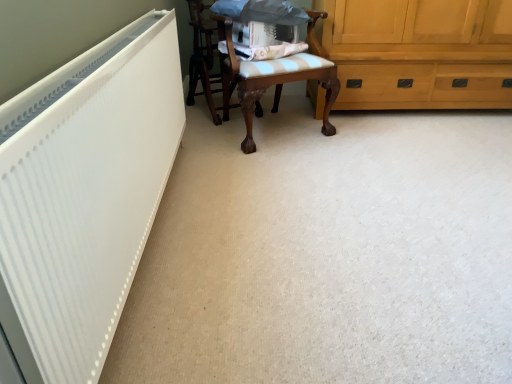
Question: Should I look upward or downward to see wooden chair with cushion at center, which is the second chair from right to left?

Choices:
 (A) down
 (B) up

Answer: (B)

Question: Is wooden chair with striped cushion at center, the 1th chair positioned from the right, in front of white matte radiator at left?

Choices:
 (A) yes
 (B) no

Answer: (B)

Question: Is wooden chair with striped cushion at center, which is the 2th chair in left-to-right order, oriented towards white matte radiator at left?

Choices:
 (A) yes
 (B) no

Answer: (B)

Question: Does wooden chair with striped cushion at center, which is the 2th chair in left-to-right order, appear on the right side of white matte radiator at left?

Choices:
 (A) yes
 (B) no

Answer: (A)

Question: Considering the relative sizes of wooden chair with striped cushion at center, which is the 2th chair in left-to-right order, and white matte radiator at left in the image provided, is wooden chair with striped cushion at center, which is the 2th chair in left-to-right order, shorter than white matte radiator at left?

Choices:
 (A) no
 (B) yes

Answer: (A)

Question: Considering the relative sizes of wooden chair with striped cushion at center, the 1th chair positioned from the right, and white matte radiator at left in the image provided, is wooden chair with striped cushion at center, the 1th chair positioned from the right, bigger than white matte radiator at left?

Choices:
 (A) yes
 (B) no

Answer: (A)

Question: Is the surface of wooden chair with striped cushion at center, which is the 2th chair in left-to-right order, in direct contact with white matte radiator at left?

Choices:
 (A) yes
 (B) no

Answer: (B)

Question: From a real-world perspective, is wooden chair with cushion at center, the first chair viewed from the left, physically below white matte radiator at left?

Choices:
 (A) no
 (B) yes

Answer: (B)

Question: From the image's perspective, is wooden chair with cushion at center, which is the second chair from right to left, over white matte radiator at left?

Choices:
 (A) yes
 (B) no

Answer: (A)

Question: Is wooden chair with cushion at center, the first chair viewed from the left, turned away from white matte radiator at left?

Choices:
 (A) yes
 (B) no

Answer: (B)

Question: Does wooden chair with cushion at center, which is the second chair from right to left, touch white matte radiator at left?

Choices:
 (A) no
 (B) yes

Answer: (A)

Question: Does wooden chair with cushion at center, the first chair viewed from the left, appear on the left side of white matte radiator at left?

Choices:
 (A) no
 (B) yes

Answer: (A)

Question: Is white matte radiator at left surrounded by wooden chair with cushion at center, which is the second chair from right to left?

Choices:
 (A) no
 (B) yes

Answer: (A)

Question: From the image's perspective, is white matte radiator at left located beneath wooden chair with cushion at center, the first chair viewed from the left?

Choices:
 (A) no
 (B) yes

Answer: (B)